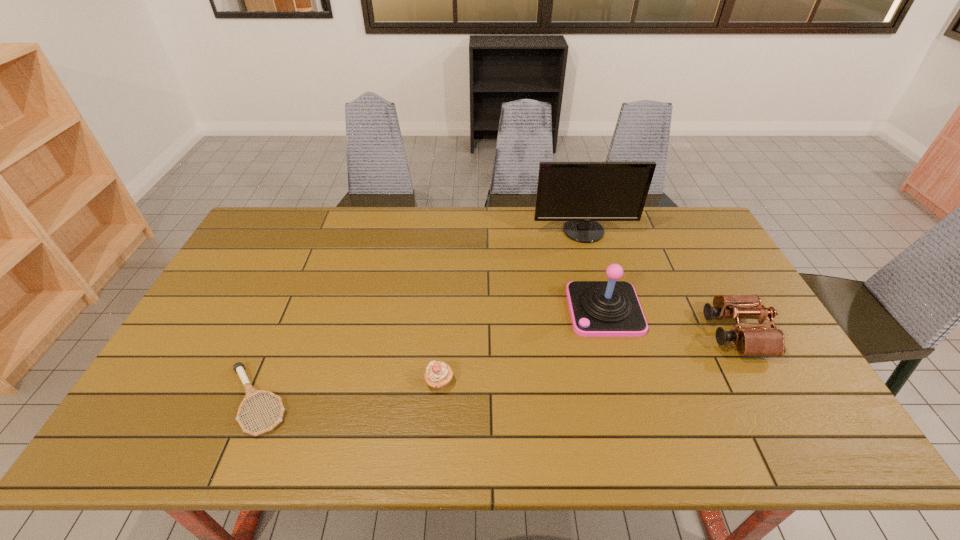
Identify the location of object that is at the right edge. (756, 340).

Locate an element on the screen. This screenshot has width=960, height=540. vacant space at the far edge of the desktop is located at coordinates (493, 211).

Where is `vacant area at the near edge of the desktop`? vacant area at the near edge of the desktop is located at coordinates (380, 422).

Where is `vacant space at the left edge`? vacant space at the left edge is located at coordinates (235, 348).

In the image, there is a desktop. Where is `vacant space at the right edge`? vacant space at the right edge is located at coordinates (690, 268).

The image size is (960, 540). What are the coordinates of `blank space at the far left corner of the desktop` in the screenshot? It's located at (276, 227).

The height and width of the screenshot is (540, 960). Identify the location of vacant space at the far right corner of the desktop. (666, 220).

Locate an element on the screen. This screenshot has height=540, width=960. free area in between the joystick and the rightmost object is located at coordinates (670, 321).

The height and width of the screenshot is (540, 960). In order to click on free space between the second tallest object and the second shortest object in this screenshot , I will do `click(522, 346)`.

The width and height of the screenshot is (960, 540). In order to click on empty space between the fourth shortest object and the binoculars in this screenshot , I will do `click(670, 321)`.